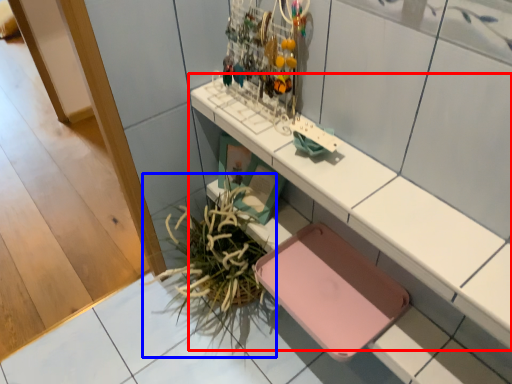
Question: Which object appears farthest to the camera in this image, shelf (highlighted by a red box) or plant (highlighted by a blue box)?

Choices:
 (A) shelf
 (B) plant

Answer: (B)